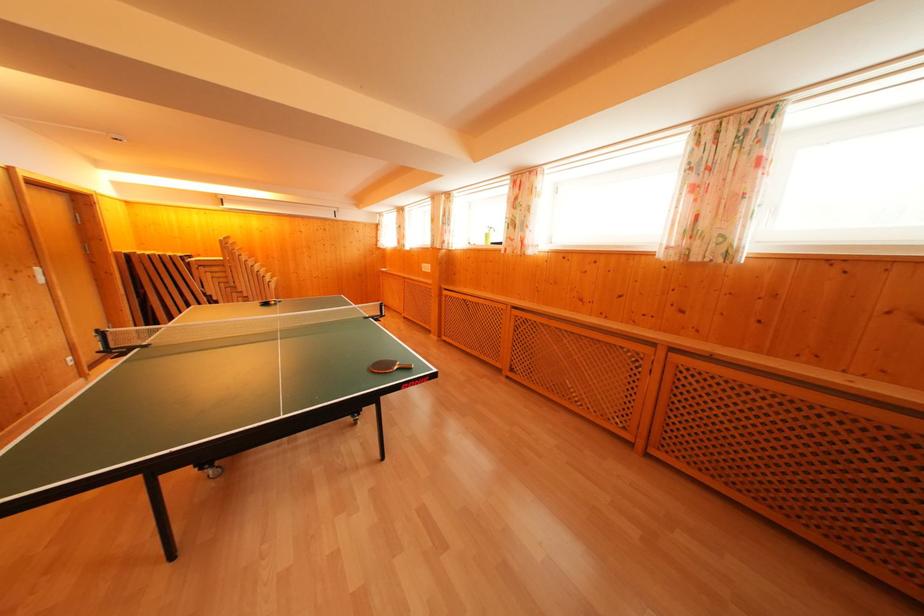
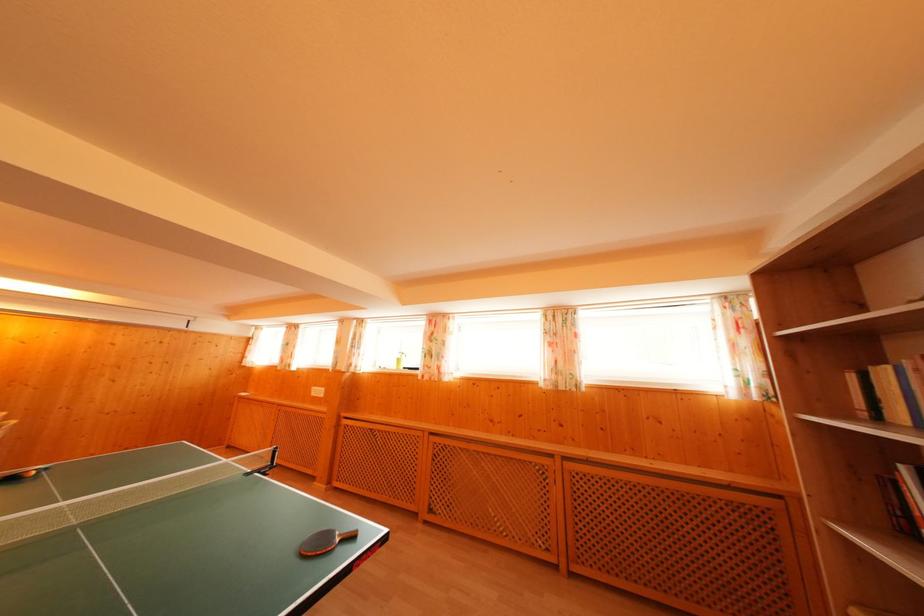
First-person continuous shooting, in which direction is the camera rotating?

The camera rotated toward right-up.